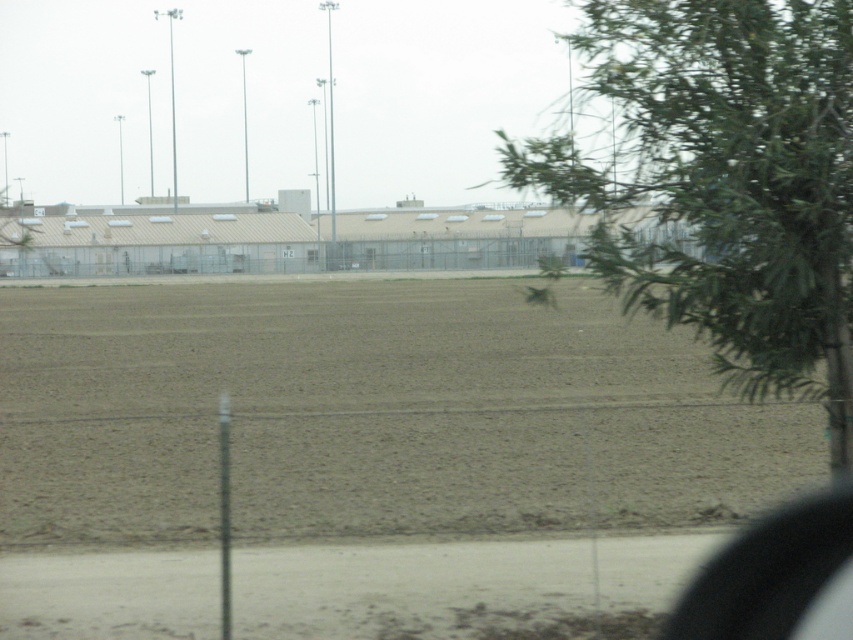
Question: Is brown soil at center above green leafy tree at upper right?

Choices:
 (A) no
 (B) yes

Answer: (A)

Question: In this image, where is brown soil at center located relative to green leafy tree at upper right?

Choices:
 (A) below
 (B) above

Answer: (A)

Question: Which point appears farthest from the camera in this image?

Choices:
 (A) (750, 291)
 (B) (242, 369)

Answer: (B)

Question: Which object is closer to the camera taking this photo?

Choices:
 (A) brown soil at center
 (B) green leafy tree at upper right

Answer: (B)

Question: Is green leafy tree at upper right above transparent glass car window at lower right?

Choices:
 (A) yes
 (B) no

Answer: (A)

Question: Which object appears closest to the camera in this image?

Choices:
 (A) green leafy tree at upper right
 (B) brown soil at center

Answer: (A)